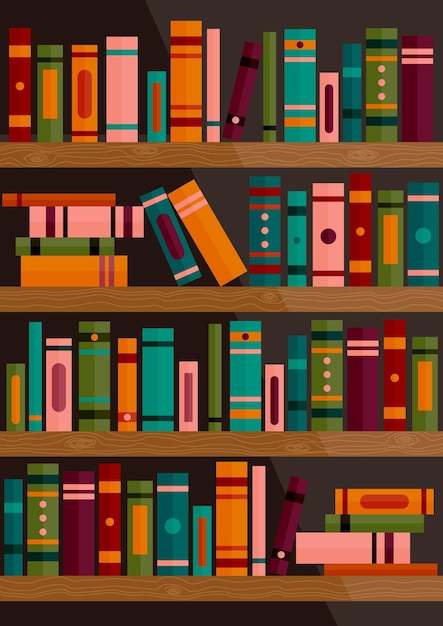
Image resolution: width=443 pixels, height=626 pixels. What are the coordinates of `illustrated shelves under books` in the screenshot? It's located at (225, 158), (221, 299), (225, 447), (222, 580).